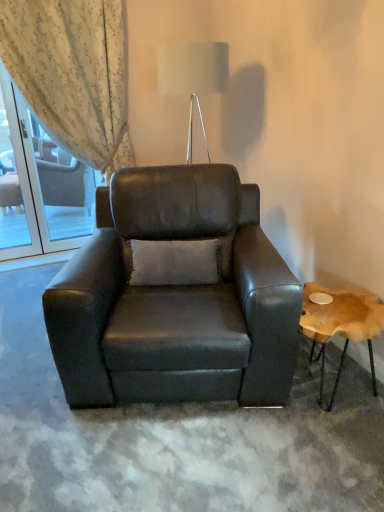
At what (x,y) coordinates should I click in order to perform the action: click on blank space situated above wooden natural stool at right (from a real-world perspective). Please return your answer as a coordinate pair (x, y). Looking at the image, I should click on (341, 311).